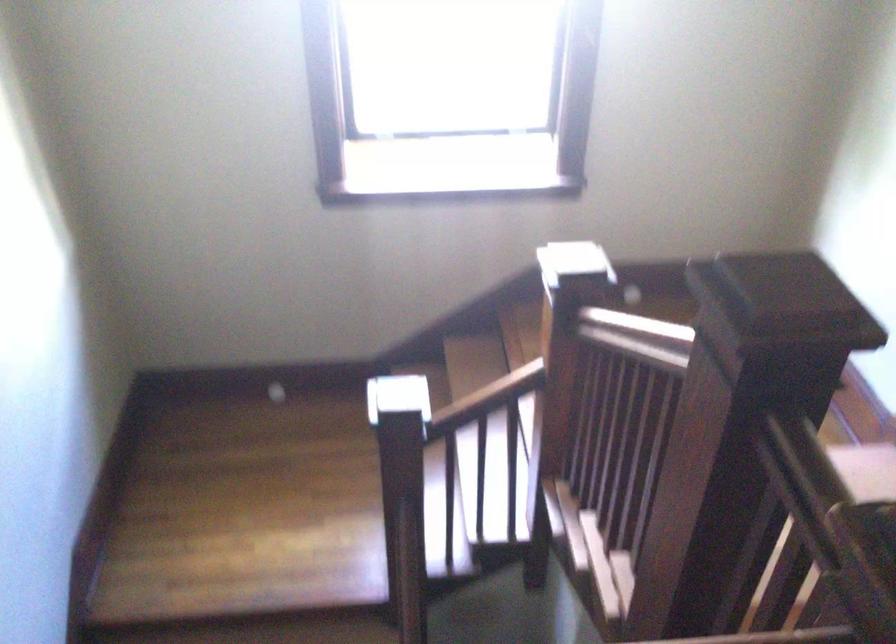
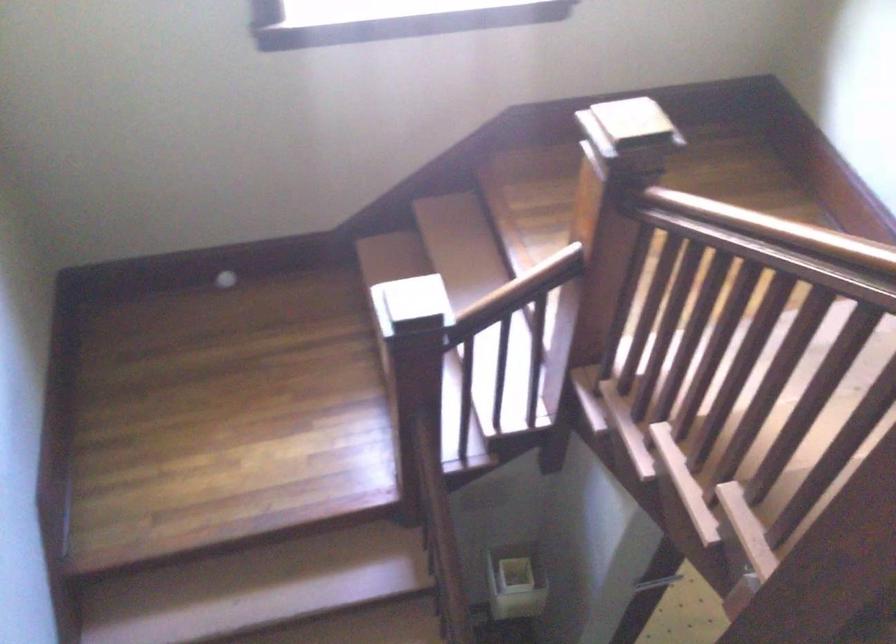
Where in the second image is the point corresponding to point (564, 323) from the first image?

(613, 205)